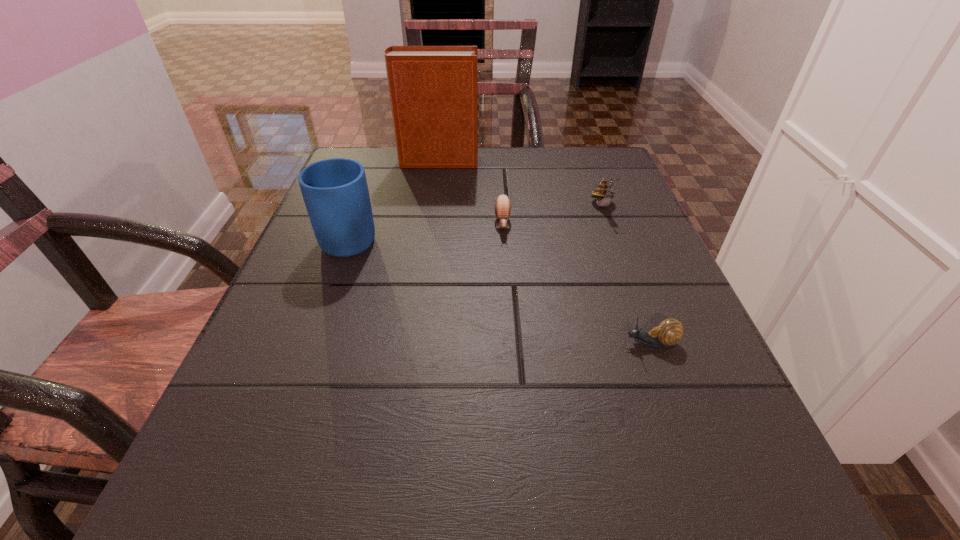
Where is `object located in the far left corner section of the desktop`? object located in the far left corner section of the desktop is located at coordinates (433, 89).

Where is `object present at the far right corner`? The height and width of the screenshot is (540, 960). object present at the far right corner is located at coordinates (603, 192).

Where is `vacant space at the far edge`? The image size is (960, 540). vacant space at the far edge is located at coordinates (491, 184).

The height and width of the screenshot is (540, 960). In the image, there is a desktop. Find the location of `vacant space at the left edge`. vacant space at the left edge is located at coordinates (348, 312).

Identify the location of vacant point at the right edge. (611, 244).

Find the location of a particular element. vacant point at the far left corner is located at coordinates (398, 171).

The image size is (960, 540). Identify the location of blank space at the far right corner of the desktop. (605, 173).

This screenshot has width=960, height=540. Find the location of `free space at the near right corner of the desktop`. free space at the near right corner of the desktop is located at coordinates (660, 534).

Where is `vacant area between the shortest escargot and the tallest escargot`? vacant area between the shortest escargot and the tallest escargot is located at coordinates (627, 274).

At what (x,y) coordinates should I click in order to perform the action: click on vacant space that's between the mug and the third tallest object. Please return your answer as a coordinate pair (x, y). This screenshot has width=960, height=540. Looking at the image, I should click on (477, 220).